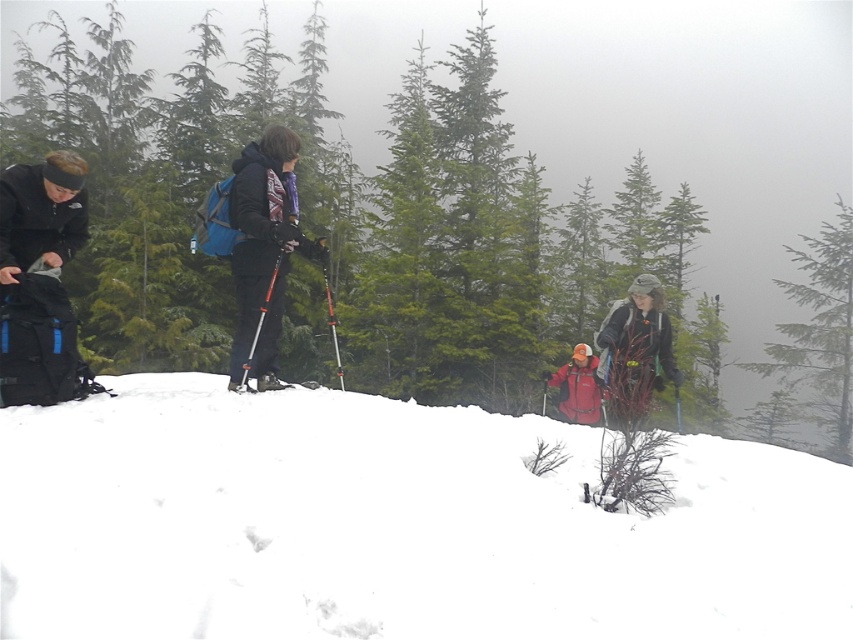
Question: Among these objects, which one is farthest from the camera?

Choices:
 (A) green matte tree at center
 (B) matte black jacket at center
 (C) matte red jacket at center

Answer: (A)

Question: Does white snow at lower left appear under matte red jacket at center?

Choices:
 (A) no
 (B) yes

Answer: (A)

Question: Is green matte tree at center to the left of black matte jacket at left from the viewer's perspective?

Choices:
 (A) yes
 (B) no

Answer: (A)

Question: Which of these objects is positioned farthest from the black matte jacket at left?

Choices:
 (A) matte red jacket at center
 (B) white snow at lower left

Answer: (A)

Question: Does white snow at lower left have a larger size compared to matte red jacket at center?

Choices:
 (A) no
 (B) yes

Answer: (B)

Question: Among these objects, which one is farthest from the camera?

Choices:
 (A) matte red jacket at center
 (B) dark gray woolen hat at right
 (C) black plastic ski pole at center

Answer: (A)